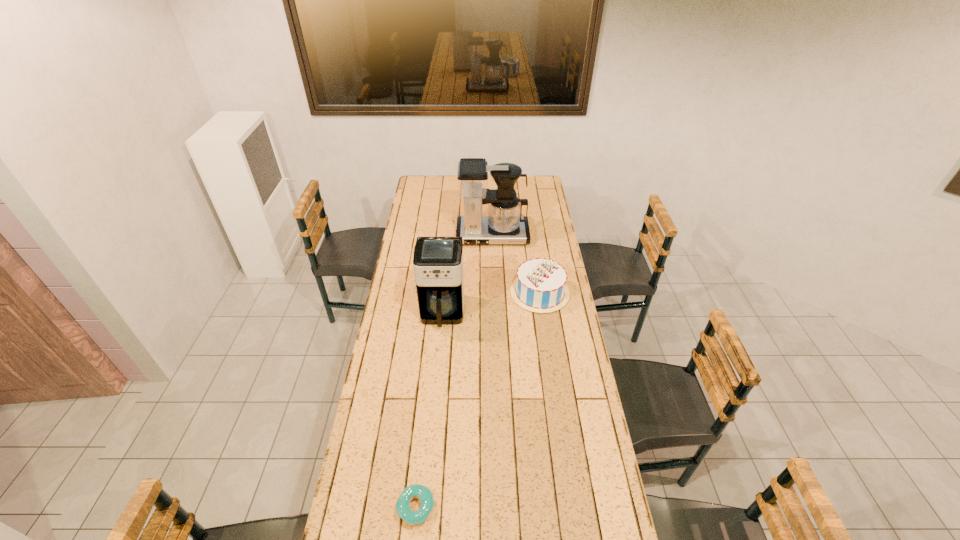
Locate an element on the screen. Image resolution: width=960 pixels, height=540 pixels. the farthest object is located at coordinates (504, 224).

Find the location of a particular element. This screenshot has width=960, height=540. the shorter coffee maker is located at coordinates (438, 261).

Locate an element on the screen. the third shortest object is located at coordinates (438, 261).

Locate an element on the screen. birthday cake is located at coordinates (540, 286).

Where is `the nearest object`? The image size is (960, 540). the nearest object is located at coordinates pyautogui.click(x=421, y=492).

The width and height of the screenshot is (960, 540). In order to click on doughnut in this screenshot , I will do `click(421, 492)`.

This screenshot has width=960, height=540. I want to click on free space located at the front of the farthest object where the controls are located, so click(x=494, y=295).

Find the location of a particular element. The image size is (960, 540). vacant space located on the front panel of the third shortest object is located at coordinates (437, 380).

Image resolution: width=960 pixels, height=540 pixels. Find the location of `vacant region located on the front of the birthday cake`. vacant region located on the front of the birthday cake is located at coordinates (547, 345).

At what (x,y) coordinates should I click in order to perform the action: click on free spot located on the right of the doughnut. Please return your answer as a coordinate pair (x, y). Looking at the image, I should click on (505, 508).